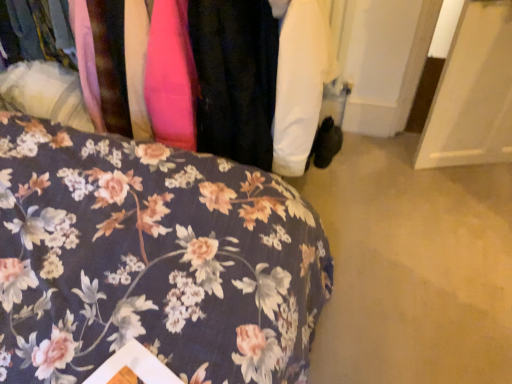
Question: Is floral fabric bedspread at lower left surrounded by floral fabric at center?

Choices:
 (A) no
 (B) yes

Answer: (A)

Question: Could you tell me if floral fabric at center is turned towards floral fabric bedspread at lower left?

Choices:
 (A) yes
 (B) no

Answer: (A)

Question: Is floral fabric at center next to floral fabric bedspread at lower left?

Choices:
 (A) no
 (B) yes

Answer: (A)

Question: From the image's perspective, is floral fabric at center under floral fabric bedspread at lower left?

Choices:
 (A) no
 (B) yes

Answer: (A)

Question: Is floral fabric at center shorter than floral fabric bedspread at lower left?

Choices:
 (A) no
 (B) yes

Answer: (B)

Question: Is floral fabric at center outside floral fabric bedspread at lower left?

Choices:
 (A) no
 (B) yes

Answer: (B)

Question: Is floral fabric bedspread at lower left positioned with its back to floral fabric at center?

Choices:
 (A) no
 (B) yes

Answer: (A)

Question: Is floral fabric at center completely or partially inside floral fabric bedspread at lower left?

Choices:
 (A) yes
 (B) no

Answer: (B)

Question: Is floral fabric bedspread at lower left smaller than floral fabric at center?

Choices:
 (A) yes
 (B) no

Answer: (B)

Question: From a real-world perspective, is floral fabric bedspread at lower left located higher than floral fabric at center?

Choices:
 (A) yes
 (B) no

Answer: (B)

Question: From the image's perspective, is floral fabric bedspread at lower left on top of floral fabric at center?

Choices:
 (A) yes
 (B) no

Answer: (B)

Question: Does floral fabric bedspread at lower left appear on the right side of floral fabric at center?

Choices:
 (A) yes
 (B) no

Answer: (B)

Question: From a real-world perspective, is floral fabric at center above or below floral fabric bedspread at lower left?

Choices:
 (A) below
 (B) above

Answer: (B)